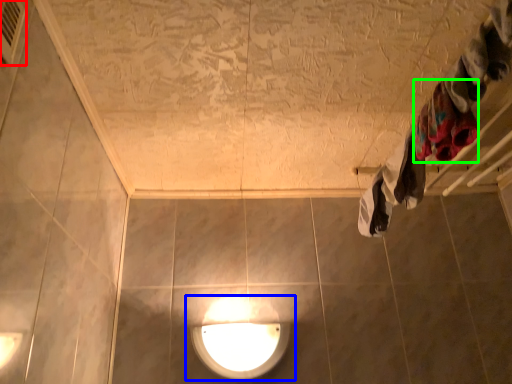
Question: Which object is positioned closest to air conditioner (highlighted by a red box)? Select from lamp (highlighted by a blue box) and clothing (highlighted by a green box).

Choices:
 (A) lamp
 (B) clothing

Answer: (B)